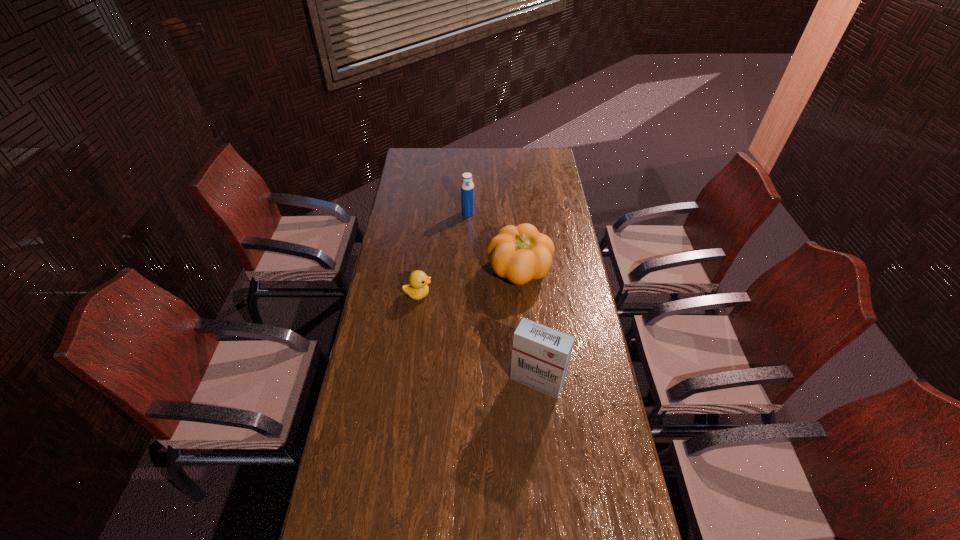
Locate an element on the screen. The image size is (960, 540). free space located 0.120m on the face of the leftmost object is located at coordinates (463, 294).

Locate an element on the screen. The image size is (960, 540). object located in the left edge section of the desktop is located at coordinates click(x=417, y=289).

Where is `cigarette case that is at the right edge`? Image resolution: width=960 pixels, height=540 pixels. cigarette case that is at the right edge is located at coordinates (540, 357).

Identify the location of pumpkin that is at the right edge. This screenshot has height=540, width=960. (520, 253).

Where is `free space at the far edge`? free space at the far edge is located at coordinates (465, 152).

Image resolution: width=960 pixels, height=540 pixels. In order to click on free point at the right edge in this screenshot , I will do `click(603, 391)`.

At what (x,y) coordinates should I click in order to perform the action: click on vacant space at the far left corner. Please return your answer as a coordinate pair (x, y). Image resolution: width=960 pixels, height=540 pixels. Looking at the image, I should click on (432, 151).

Where is `free spot between the leftmost object and the pumpkin`? The image size is (960, 540). free spot between the leftmost object and the pumpkin is located at coordinates (468, 283).

Where is `free spot between the leftmost object and the third object from right to left`? free spot between the leftmost object and the third object from right to left is located at coordinates (443, 254).

Locate an element on the screen. This screenshot has width=960, height=540. free space between the water bottle and the duck is located at coordinates (443, 254).